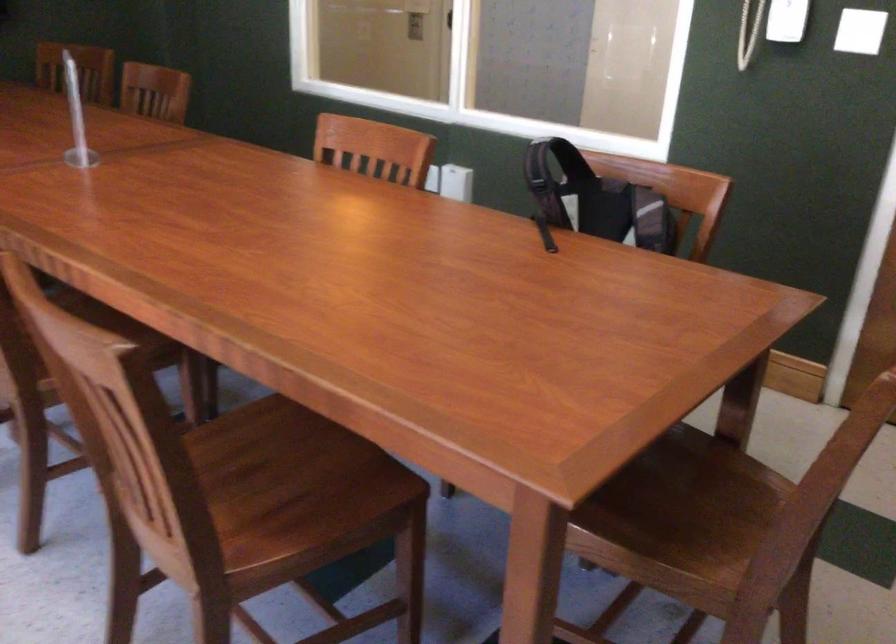
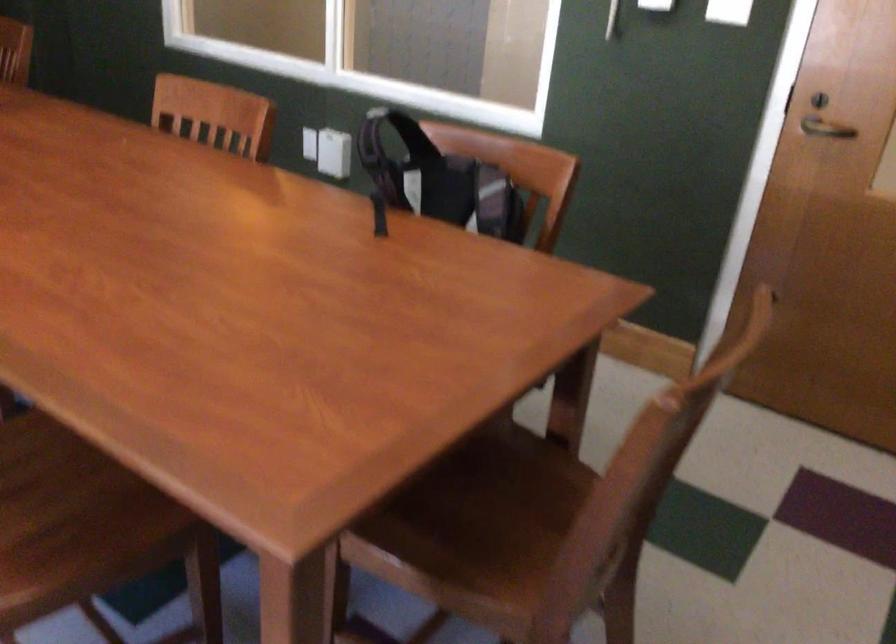
The point at [595,200] is marked in the first image. Where is the corresponding point in the second image?

(438, 180)